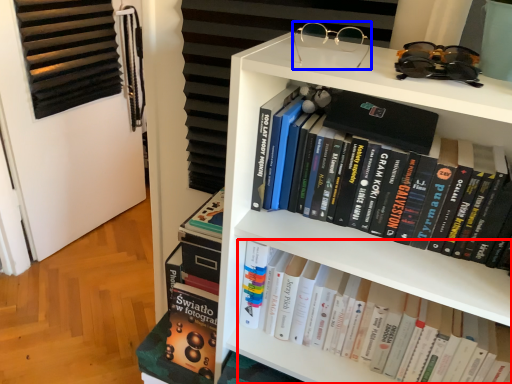
Question: Which object appears closest to the camera in this image, book (highlighted by a red box) or glasses (highlighted by a blue box)?

Choices:
 (A) book
 (B) glasses

Answer: (B)